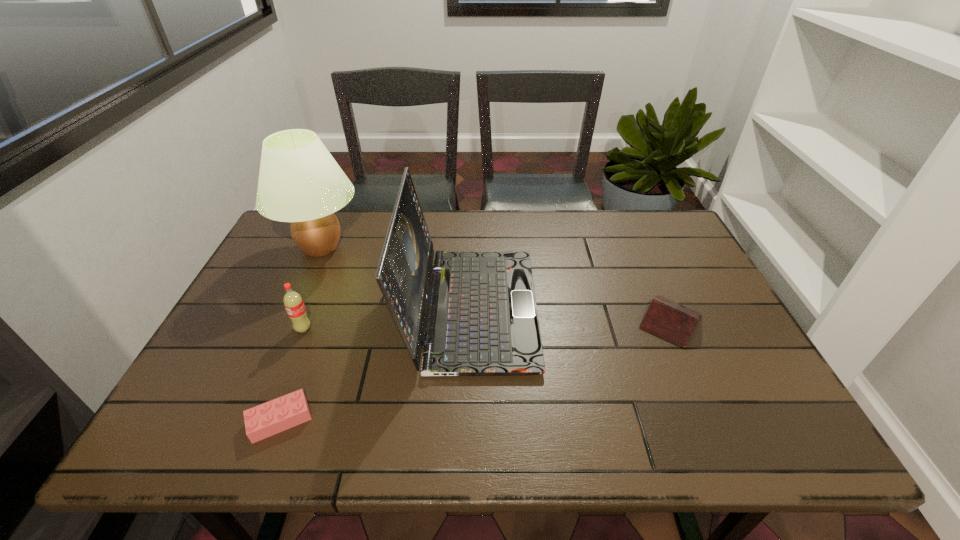
Identify which object is the closest to the second tallest object. Please provide its 2D coordinates. Your answer should be formatted as a tuple, i.e. [(x, y)], where the tuple contains the x and y coordinates of a point satisfying the conditions above.

[(300, 182)]

Identify the location of free point that satisfies the following two spatial constraints: 1. on the shade of the lampshade; 2. on the right side of the rightmost object. The width and height of the screenshot is (960, 540). (288, 321).

At what (x,y) coordinates should I click in order to perform the action: click on vacant space that satisfies the following two spatial constraints: 1. on the shade of the Lego; 2. on the right side of the lampshade. Please return your answer as a coordinate pair (x, y). Looking at the image, I should click on (244, 420).

Find the location of `blank space that satisfies the following two spatial constraints: 1. on the shade of the lampshade; 2. on the left side of the soda`. blank space that satisfies the following two spatial constraints: 1. on the shade of the lampshade; 2. on the left side of the soda is located at coordinates (284, 329).

Locate an element on the screen. This screenshot has height=540, width=960. vacant space that satisfies the following two spatial constraints: 1. on the screen of the rightmost object; 2. on the left side of the second object from right to left is located at coordinates (471, 321).

I want to click on free space that satisfies the following two spatial constraints: 1. on the shade of the lampshade; 2. on the back side of the rightmost object, so click(x=288, y=321).

Locate an element on the screen. vacant space that satisfies the following two spatial constraints: 1. on the back side of the book; 2. on the right side of the Lego is located at coordinates (318, 321).

Where is `free space that satisfies the following two spatial constraints: 1. on the shade of the rightmost object; 2. on the left side of the lampshade`? The width and height of the screenshot is (960, 540). free space that satisfies the following two spatial constraints: 1. on the shade of the rightmost object; 2. on the left side of the lampshade is located at coordinates (288, 321).